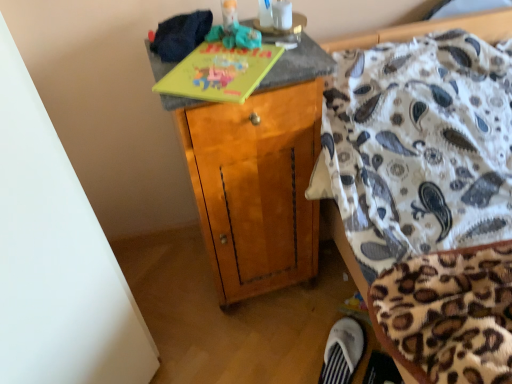
You are a GUI agent. You are given a task and a screenshot of the screen. Output one action in this format:
    pyautogui.click(x=<x>, y=<y>)
    Task: Click on the free space that is to the left of wooden cabinet at center
    The width and height of the screenshot is (512, 384).
    Given the screenshot: What is the action you would take?
    tap(172, 288)